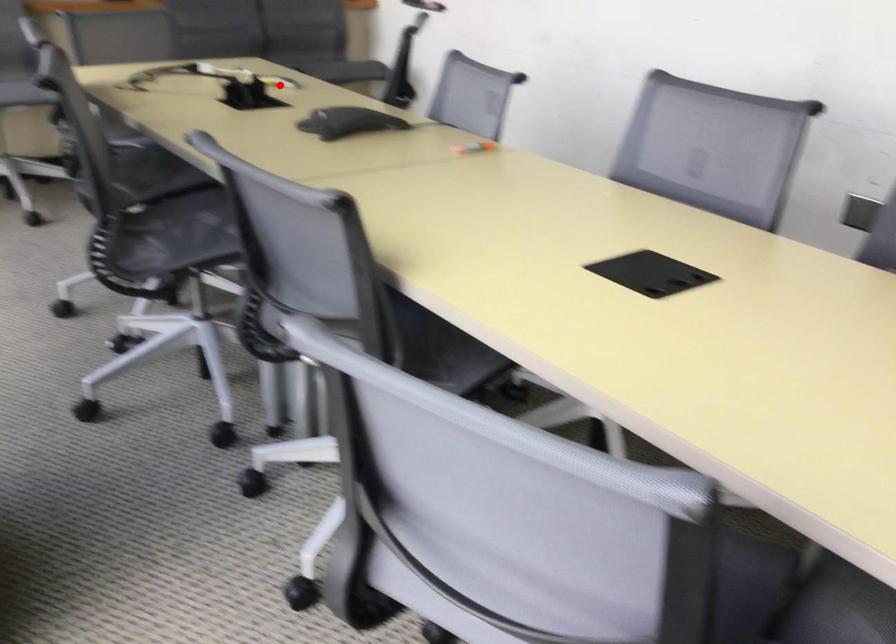
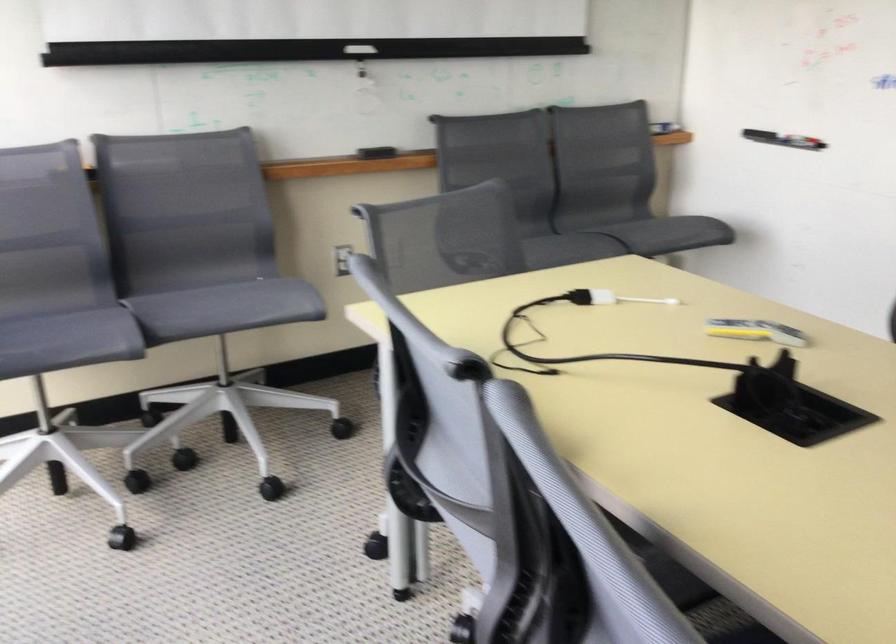
Question: I am providing you with two images of the same scene from different viewpoints. Given a red point in image1, look at the same physical point in image2. Is it:

Choices:
 (A) Closer to the viewpoint
 (B) Farther from the viewpoint

Answer: (A)